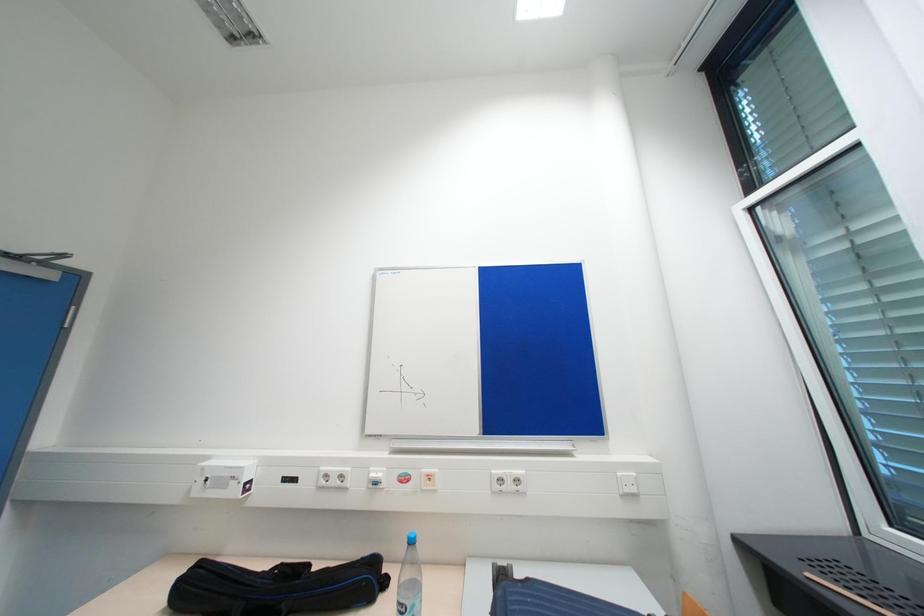
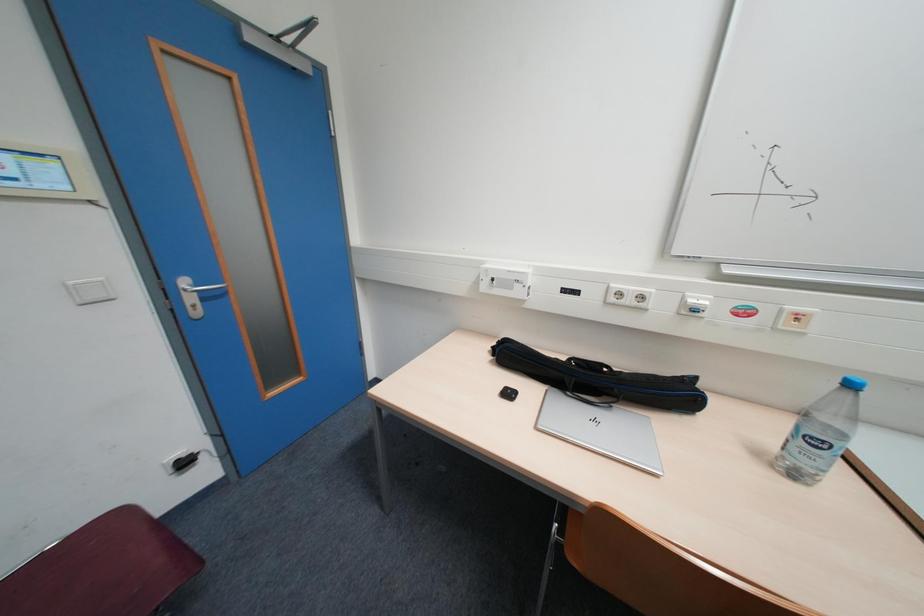
Based on the photo, the first image is from the beginning of the video and the second image is from the end. How did the camera likely rotate when shooting the video?

The camera rotated toward left-down.